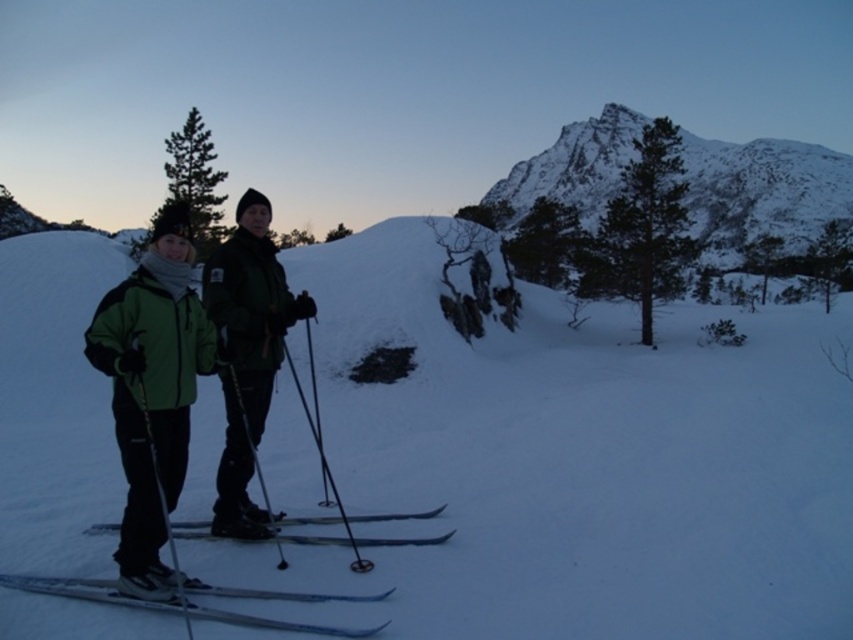
Question: Does green matte jacket at left have a lesser width compared to snowy granite mountain at upper right?

Choices:
 (A) no
 (B) yes

Answer: (B)

Question: Is green matte jacket at center above shiny metallic skis at center?

Choices:
 (A) no
 (B) yes

Answer: (B)

Question: Which of the following is the farthest from the observer?

Choices:
 (A) black matte ski pole at center
 (B) snowy granite mountain at upper right

Answer: (B)

Question: Which point is closer to the camera taking this photo?

Choices:
 (A) (296, 541)
 (B) (242, 529)

Answer: (A)

Question: Which of the following is the farthest from the observer?

Choices:
 (A) green matte jacket at left
 (B) black matte ski pole at center
 (C) green matte jacket at center
 (D) metallic ski pole at left

Answer: (C)

Question: In this image, where is snowy granite mountain at upper right located relative to black matte ski pole at center?

Choices:
 (A) left
 (B) right

Answer: (B)